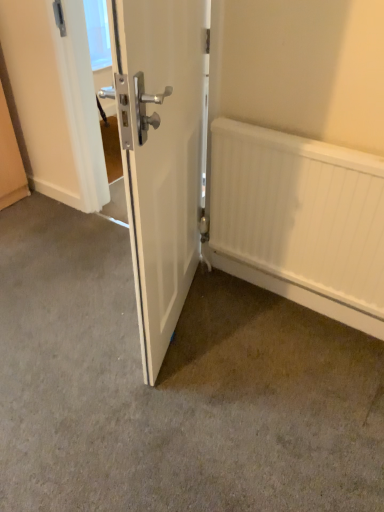
Measure the distance between smooth concrete floor at center and camera.

smooth concrete floor at center is 1.23 meters away from camera.

The width and height of the screenshot is (384, 512). What do you see at coordinates (172, 387) in the screenshot?
I see `smooth concrete floor at center` at bounding box center [172, 387].

In order to face white glossy door at center, should I rotate leftwards or rightwards?

Rotate your view left by about 2.575°.

This screenshot has width=384, height=512. In order to click on smooth concrete floor at center in this screenshot , I will do `click(172, 387)`.

From the image's perspective, is white glossy door at center located above or below white matte radiator at lower right?

Clearly, from the image's perspective, white glossy door at center is above white matte radiator at lower right.

Is white glossy door at center positioned far away from white matte radiator at lower right?

They are positioned close to each other.

Can white matte radiator at lower right be found inside white glossy door at center?

That's incorrect, white matte radiator at lower right is not inside white glossy door at center.

Between white glossy door at center and white matte radiator at lower right, which one has larger width?

Wider between the two is white glossy door at center.

Is smooth concrete floor at center touching white matte radiator at lower right?

There is a gap between smooth concrete floor at center and white matte radiator at lower right.

Is white matte radiator at lower right inside smooth concrete floor at center?

No, white matte radiator at lower right is not a part of smooth concrete floor at center.

Which is in front, smooth concrete floor at center or white matte radiator at lower right?

smooth concrete floor at center is in front.

Can you confirm if smooth concrete floor at center is bigger than white matte radiator at lower right?

Yes.

Can we say smooth concrete floor at center lies outside white glossy door at center?

Yes, smooth concrete floor at center is located beyond the bounds of white glossy door at center.

Would you say smooth concrete floor at center is a long distance from white glossy door at center?

No, smooth concrete floor at center is not far away from white glossy door at center.

Considering the sizes of objects smooth concrete floor at center and white glossy door at center in the image provided, who is taller, smooth concrete floor at center or white glossy door at center?

white glossy door at center is taller.

Which object is positioned more to the right, smooth concrete floor at center or white glossy door at center?

From the viewer's perspective, white glossy door at center appears more on the right side.

How different are the orientations of white matte radiator at lower right and white glossy door at center in degrees?

68.6 degrees.

From a real-world perspective, is white matte radiator at lower right over white glossy door at center?

No, from a real-world perspective, white matte radiator at lower right is not above white glossy door at center.

Does white matte radiator at lower right appear on the left side of white glossy door at center?

In fact, white matte radiator at lower right is to the right of white glossy door at center.

Is white matte radiator at lower right next to smooth concrete floor at center?

No.

Can you tell me how much white matte radiator at lower right and smooth concrete floor at center differ in facing direction?

There is a 179-degree angle between the facing directions of white matte radiator at lower right and smooth concrete floor at center.

From the picture: Considering the positions of objects white matte radiator at lower right and smooth concrete floor at center in the image provided, who is more to the right, white matte radiator at lower right or smooth concrete floor at center?

From the viewer's perspective, white matte radiator at lower right appears more on the right side.

How much distance is there between white matte radiator at lower right and smooth concrete floor at center?

They are 20.76 inches apart.

Could you tell me if white glossy door at center is facing smooth concrete floor at center?

Yes, white glossy door at center is turned towards smooth concrete floor at center.

Is white glossy door at center positioned far away from smooth concrete floor at center?

white glossy door at center is near smooth concrete floor at center, not far away.

Is white glossy door at center further to camera compared to smooth concrete floor at center?

No, white glossy door at center is closer to the viewer.

The height and width of the screenshot is (512, 384). What are the coordinates of `door on the right of smooth concrete floor at center` in the screenshot? It's located at (161, 154).

Locate an element on the screen. The width and height of the screenshot is (384, 512). door in front of the white matte radiator at lower right is located at coordinates (161, 154).

The image size is (384, 512). Identify the location of concrete that appears below the white matte radiator at lower right (from the image's perspective). (172, 387).

When comparing their distances from white glossy door at center, does smooth concrete floor at center or white matte radiator at lower right seem further?

The object further to white glossy door at center is smooth concrete floor at center.

Based on their spatial positions, is white matte radiator at lower right or white glossy door at center further from smooth concrete floor at center?

Based on the image, white matte radiator at lower right appears to be further to smooth concrete floor at center.

When comparing their distances from white glossy door at center, does white matte radiator at lower right or smooth concrete floor at center seem closer?

The object closer to white glossy door at center is white matte radiator at lower right.

Considering their positions, is smooth concrete floor at center positioned closer to white matte radiator at lower right than white glossy door at center?

white glossy door at center lies closer to white matte radiator at lower right than the other object.

From the image, which object appears to be nearer to white matte radiator at lower right, white glossy door at center or smooth concrete floor at center?

The object closer to white matte radiator at lower right is white glossy door at center.

Looking at the image, which one is located closer to smooth concrete floor at center, white glossy door at center or white matte radiator at lower right?

white glossy door at center.

Find the location of a particular element. door situated between smooth concrete floor at center and white matte radiator at lower right from left to right is located at coordinates (161, 154).